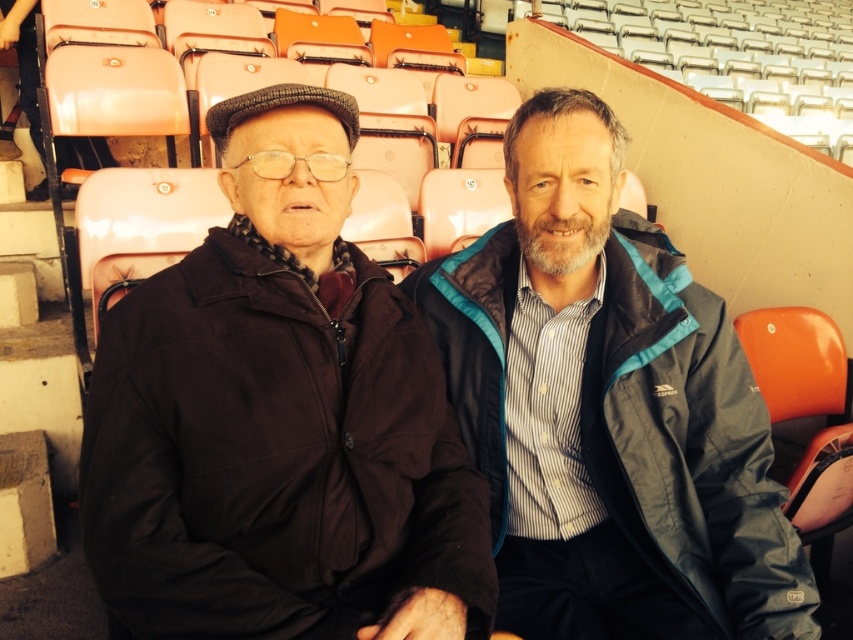
Question: Does dark brown fabric jacket at left lie behind blue fabric jacket at center?

Choices:
 (A) no
 (B) yes

Answer: (A)

Question: Is dark brown fabric jacket at left closer to the viewer compared to blue fabric jacket at center?

Choices:
 (A) yes
 (B) no

Answer: (A)

Question: In this image, where is dark brown fabric jacket at left located relative to blue fabric jacket at center?

Choices:
 (A) below
 (B) above

Answer: (B)

Question: Which point is closer to the camera taking this photo?

Choices:
 (A) (410, 326)
 (B) (657, 397)

Answer: (A)